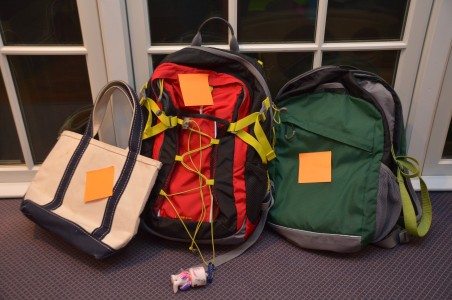
This screenshot has height=300, width=452. In order to click on carpet floor in this screenshot , I will do `click(119, 288)`.